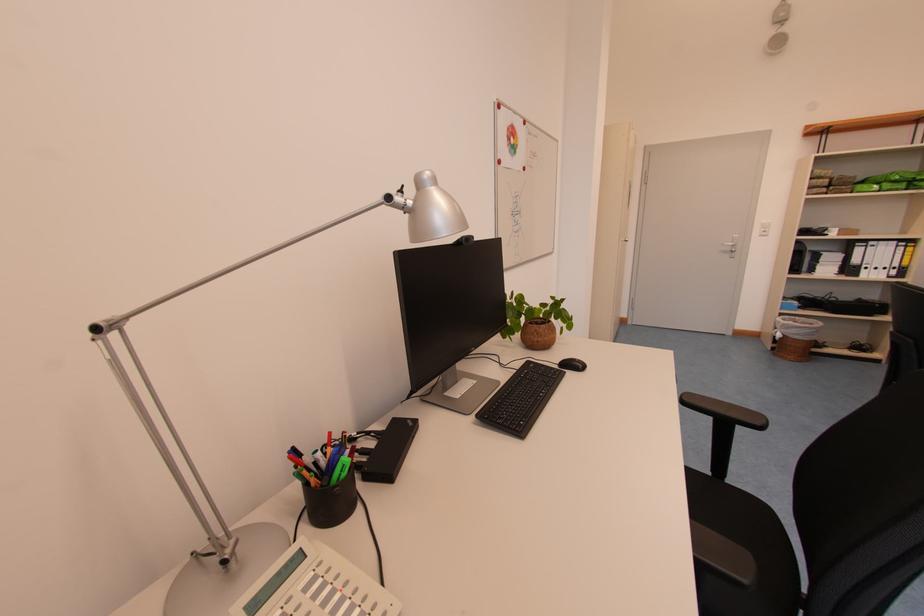
What do you see at coordinates (734, 245) in the screenshot? The height and width of the screenshot is (616, 924). I see `the silver door handle` at bounding box center [734, 245].